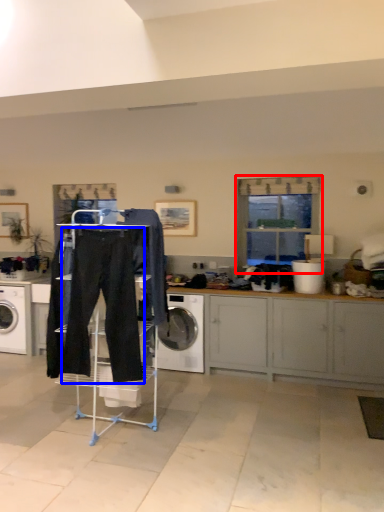
Question: Among these objects, which one is nearest to the camera, window (highlighted by a red box) or sweat pant (highlighted by a blue box)?

Choices:
 (A) window
 (B) sweat pant

Answer: (B)